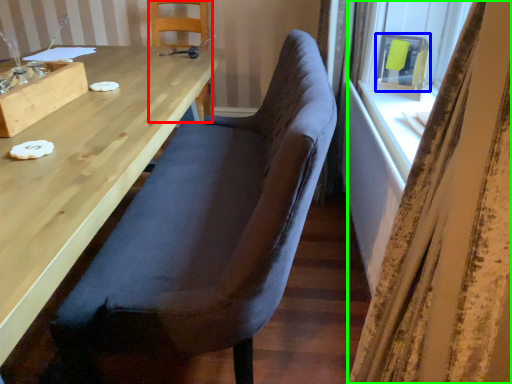
Question: Based on their relative distances, which object is nearer to chair (highlighted by a red box)? Choose from window screen (highlighted by a blue box) and curtain (highlighted by a green box).

Choices:
 (A) window screen
 (B) curtain

Answer: (A)